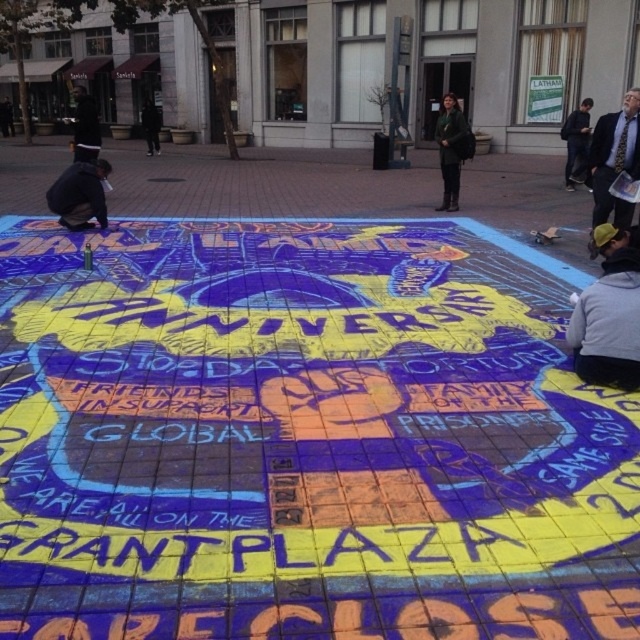
Is gray sweatshirt at lower right thinner than light blue shirt at upper right?

In fact, gray sweatshirt at lower right might be wider than light blue shirt at upper right.

Between gray sweatshirt at lower right and light blue shirt at upper right, which one appears on the right side from the viewer's perspective?

light blue shirt at upper right

Image resolution: width=640 pixels, height=640 pixels. I want to click on gray sweatshirt at lower right, so click(609, 316).

At what (x,y) coordinates should I click in order to perform the action: click on gray sweatshirt at lower right. Please return your answer as a coordinate pair (x, y). The image size is (640, 640). Looking at the image, I should click on (609, 316).

Can you confirm if light blue shirt at upper right is positioned to the right of dark blue jeans at lower right?

Incorrect, light blue shirt at upper right is not on the right side of dark blue jeans at lower right.

Can you confirm if light blue shirt at upper right is taller than dark blue jeans at lower right?

No.

Image resolution: width=640 pixels, height=640 pixels. Find the location of `light blue shirt at upper right`. light blue shirt at upper right is located at coordinates (614, 160).

Which of these two, dark blue jacket at left or dark green jacket at center, stands taller?

dark green jacket at center

Locate an element on the screen. The height and width of the screenshot is (640, 640). dark blue jacket at left is located at coordinates (80, 195).